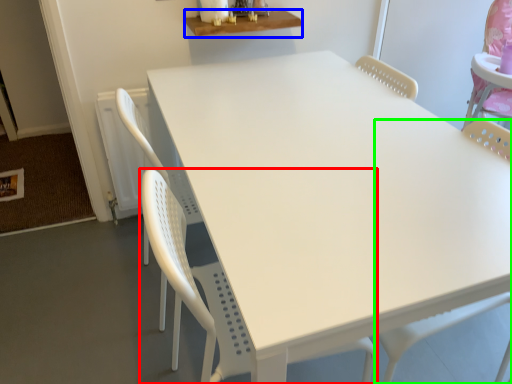
Question: Which object is the closest to the chair (highlighted by a red box)? Choose among these: table (highlighted by a blue box) or swivel chair (highlighted by a green box).

Choices:
 (A) table
 (B) swivel chair

Answer: (B)